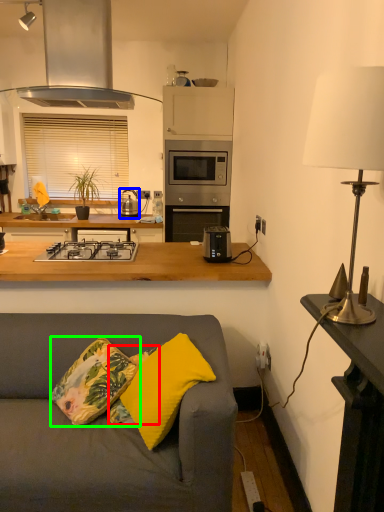
Question: Estimate the real-world distances between objects in this image. Which object is closer to pillow (highlighted by a red box), appliance (highlighted by a blue box) or throw pillow (highlighted by a green box)?

Choices:
 (A) appliance
 (B) throw pillow

Answer: (B)